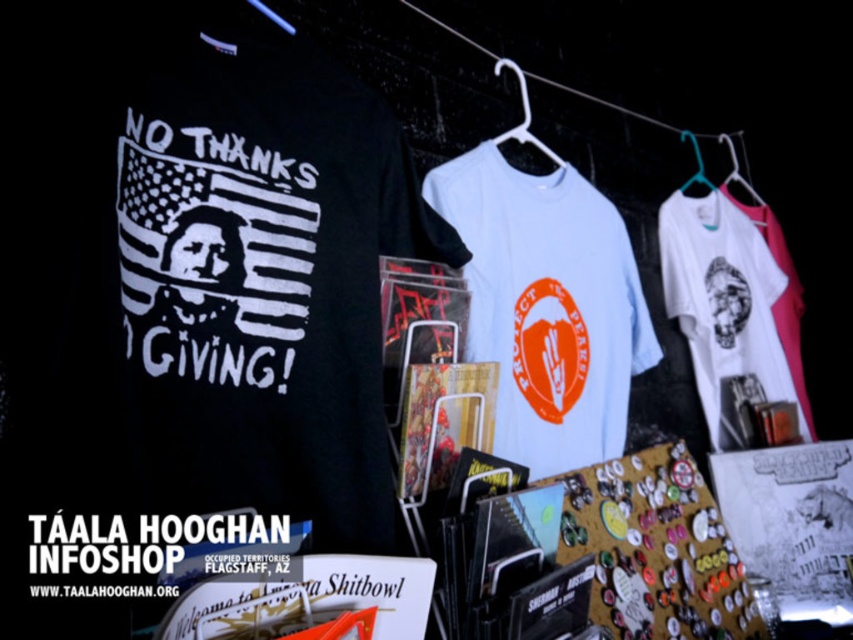
Question: Is white matte t-shirt at upper right above matte plastic hanger at upper center?

Choices:
 (A) no
 (B) yes

Answer: (A)

Question: Among these points, which one is nearest to the camera?

Choices:
 (A) click(x=683, y=308)
 (B) click(x=521, y=113)
 (C) click(x=688, y=179)
 (D) click(x=303, y=497)

Answer: (D)

Question: Which point is closer to the camera?

Choices:
 (A) white matte t-shirt at upper right
 (B) white plastic hanger at upper center
 (C) white fabric shirt at upper center

Answer: (B)

Question: Which object appears farthest from the camera in this image?

Choices:
 (A) light blue cotton t-shirt at center
 (B) white matte t-shirt at upper right

Answer: (B)

Question: Where is black matte t-shirt at left located in relation to matte plastic hanger at upper center in the image?

Choices:
 (A) left
 (B) right

Answer: (A)

Question: Is matte plastic hanger at upper center further to camera compared to white fabric shirt at upper center?

Choices:
 (A) no
 (B) yes

Answer: (A)